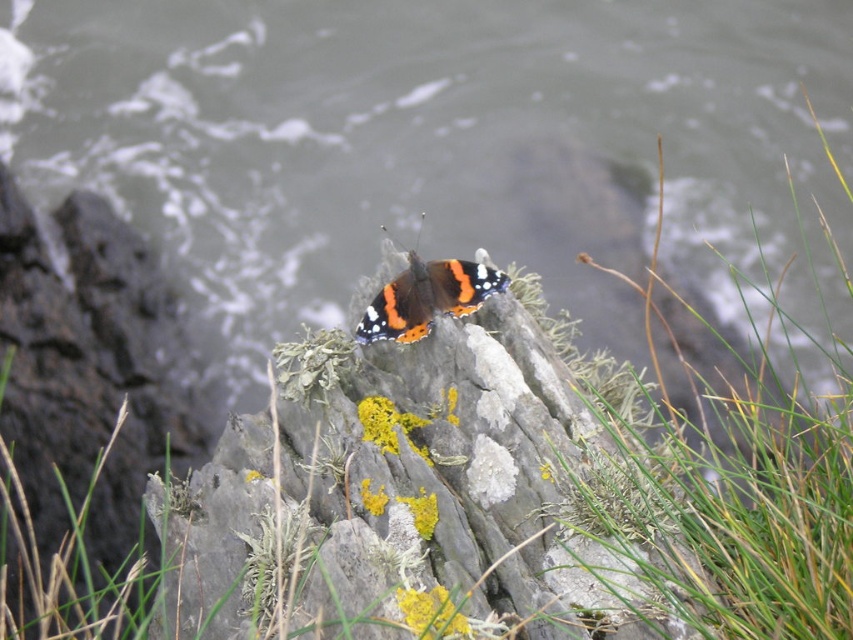
You are a photographer aiming to capture the shiny orange butterfly at center. Based on the scene, where should you focus your camera to ensure the butterfly is in sharp focus while the gray rough rock at center remains slightly out of focus?

To ensure the shiny orange butterfly at center is in sharp focus while the gray rough rock at center is slightly out of focus, focus on the shiny orange butterfly at center since it is positioned above the gray rough rock at center, creating a depth of field where the rock may blur slightly in the background.

You are a photographer adjusting your camera to focus on two points in the scene. The first point is point (509, 584) and the second is point (25, 456). Since you can only focus on one point at a time, which point should you choose to ensure the butterfly is in focus?

You should focus on point (509, 584) because it is closer to the camera than point (25, 456), and the butterfly is likely positioned at the closer point.